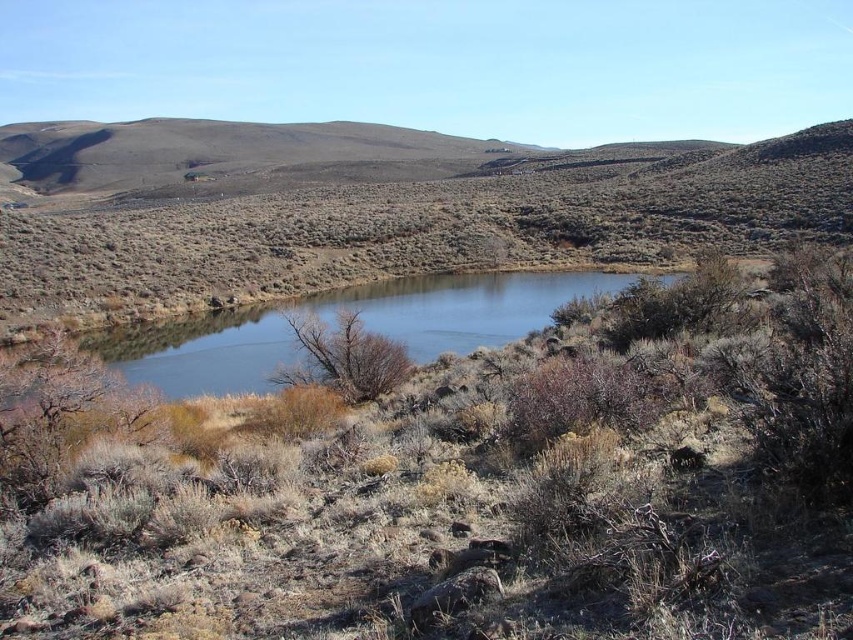
Question: Which point is farther to the camera?

Choices:
 (A) (216, 404)
 (B) (235, 376)
 (C) (263, 216)

Answer: (C)

Question: Which of the following is the closest to the observer?

Choices:
 (A) (30, 256)
 (B) (448, 342)

Answer: (B)

Question: Which of these objects is positioned closest to the dry grass at center?

Choices:
 (A) clear water at center
 (B) brown textured hillside at upper center

Answer: (A)

Question: Is dry grass at center further to the viewer compared to brown textured hillside at upper center?

Choices:
 (A) no
 (B) yes

Answer: (A)

Question: Considering the relative positions of dry grass at center and clear water at center in the image provided, where is dry grass at center located with respect to clear water at center?

Choices:
 (A) below
 (B) above

Answer: (A)

Question: Is dry grass at center above clear water at center?

Choices:
 (A) yes
 (B) no

Answer: (B)